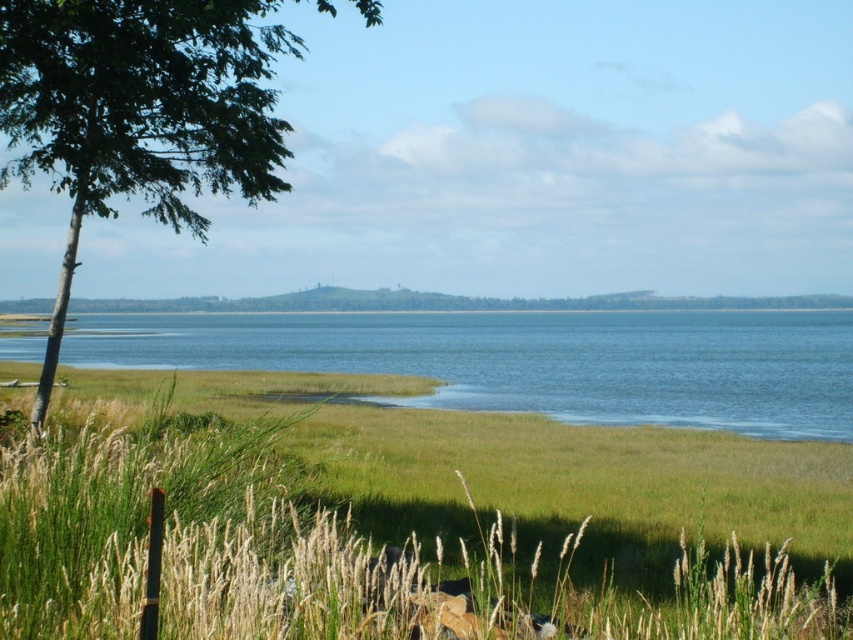
In the scene shown: You are standing on the green grassy at lower center and want to reach the green leafy tree at left. Which direction should you walk to get closer to the tree?

Since the green grassy at lower center is smaller in size compared to the green leafy tree at left, you should walk towards the left direction to reach the tree.

You are standing at the point marked as point (x=405, y=518) in the image. What do you see directly in front of you?

You see the green grassy area at lower center directly in front of you at point (x=405, y=518).